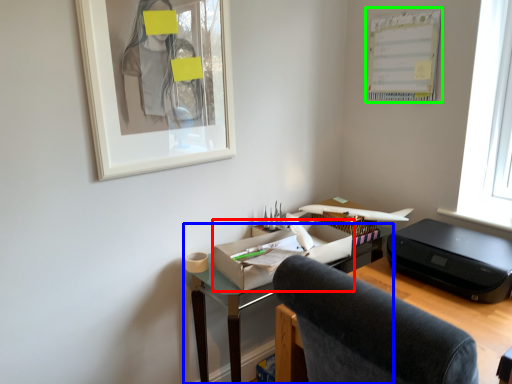
Question: Which is nearer to the office supplies (highlighted by a red box)? desk (highlighted by a blue box) or bulletin board (highlighted by a green box).

Choices:
 (A) desk
 (B) bulletin board

Answer: (A)